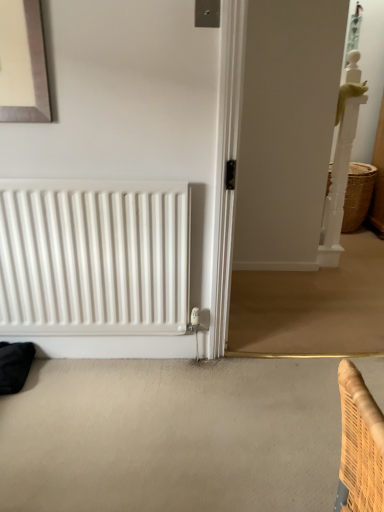
Question: Would you say woven straw basket at right is a long distance from white glossy screen door at right?

Choices:
 (A) yes
 (B) no

Answer: (B)

Question: Considering the relative positions of woven straw basket at right and white glossy screen door at right in the image provided, is woven straw basket at right in front of white glossy screen door at right?

Choices:
 (A) yes
 (B) no

Answer: (B)

Question: Is white glossy screen door at right a part of woven straw basket at right?

Choices:
 (A) yes
 (B) no

Answer: (B)

Question: From a real-world perspective, is woven straw basket at right located higher than white glossy screen door at right?

Choices:
 (A) yes
 (B) no

Answer: (B)

Question: Considering the relative positions of woven straw basket at right and white glossy screen door at right in the image provided, is woven straw basket at right to the right of white glossy screen door at right from the viewer's perspective?

Choices:
 (A) no
 (B) yes

Answer: (B)

Question: Does woven straw basket at right have a lesser width compared to white glossy screen door at right?

Choices:
 (A) no
 (B) yes

Answer: (A)

Question: From the image's perspective, is woven straw basket at right over white matte radiator at lower left?

Choices:
 (A) no
 (B) yes

Answer: (B)

Question: From a real-world perspective, is woven straw basket at right on white matte radiator at lower left?

Choices:
 (A) yes
 (B) no

Answer: (B)

Question: Is woven straw basket at right taller than white matte radiator at lower left?

Choices:
 (A) yes
 (B) no

Answer: (B)

Question: Is woven straw basket at right aimed at white matte radiator at lower left?

Choices:
 (A) no
 (B) yes

Answer: (A)

Question: Is the depth of woven straw basket at right less than that of white matte radiator at lower left?

Choices:
 (A) no
 (B) yes

Answer: (A)

Question: Does woven straw basket at right appear on the right side of white matte radiator at lower left?

Choices:
 (A) no
 (B) yes

Answer: (B)

Question: Is white glossy screen door at right not near white matte radiator at lower left?

Choices:
 (A) yes
 (B) no

Answer: (A)